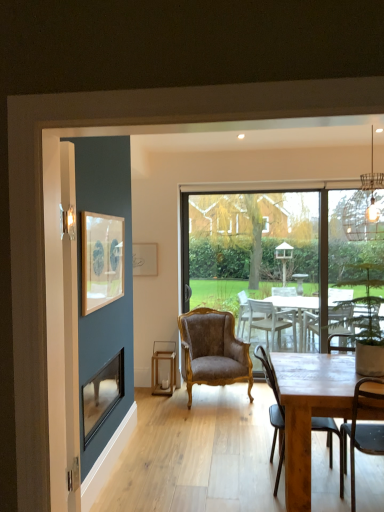
At what (x,y) coordinates should I click in order to perform the action: click on free region under wooden framed artwork at upper left, acting as the first picture frame starting from the front (from a real-world perspective). Please return your answer as a coordinate pair (x, y). Looking at the image, I should click on (108, 442).